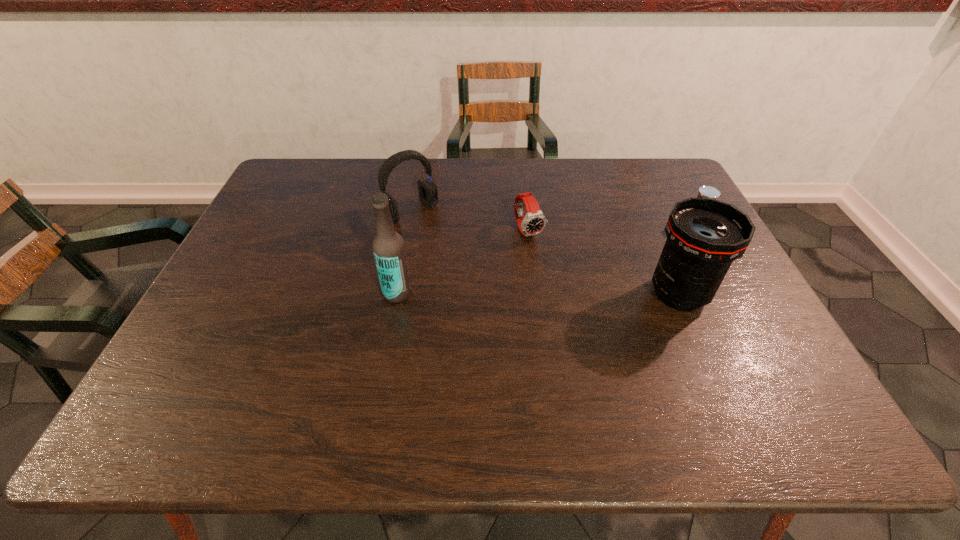
Where is `free space that satisfies the following two spatial constraints: 1. on the front side of the beer bottle; 2. on the side of the headset with the label`? This screenshot has width=960, height=540. free space that satisfies the following two spatial constraints: 1. on the front side of the beer bottle; 2. on the side of the headset with the label is located at coordinates (396, 293).

Locate an element on the screen. The width and height of the screenshot is (960, 540). blank space that satisfies the following two spatial constraints: 1. on the front side of the third shortest object; 2. on the side of the tallest object with the label is located at coordinates (396, 293).